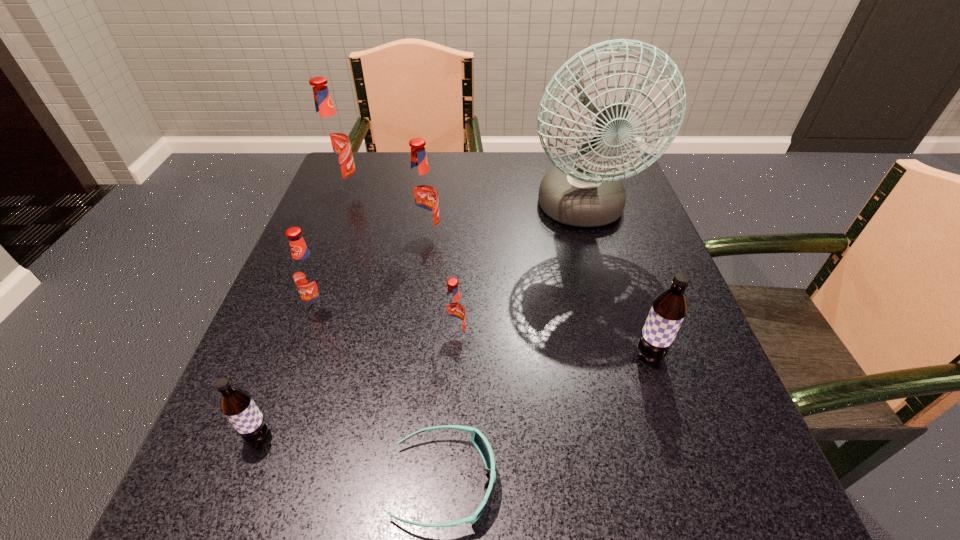
Where is `the fifth root beer from left to right`? This screenshot has height=540, width=960. the fifth root beer from left to right is located at coordinates (454, 314).

This screenshot has height=540, width=960. Identify the location of the left brown root beer. (236, 404).

The height and width of the screenshot is (540, 960). Find the location of `the nearer brown root beer`. the nearer brown root beer is located at coordinates (236, 404).

Where is `the shortest object`? The width and height of the screenshot is (960, 540). the shortest object is located at coordinates (478, 439).

Where is `sunglasses`? sunglasses is located at coordinates (478, 439).

Locate an element on the screen. The image size is (960, 540). vacant region located in front of the tallest object where the airflow is directed is located at coordinates point(615,329).

The width and height of the screenshot is (960, 540). Identify the location of blank area located on the front of the farthest red root beer. (331, 224).

Find the location of `vacant area situated on the right of the sixth shortest object`. vacant area situated on the right of the sixth shortest object is located at coordinates (579, 237).

Locate an element on the screen. The image size is (960, 540). free space located 0.250m on the front of the fourth nearest root beer is located at coordinates (270, 455).

Identify the location of vacant space positioned on the right of the bigger brown root beer. This screenshot has width=960, height=540. (694, 355).